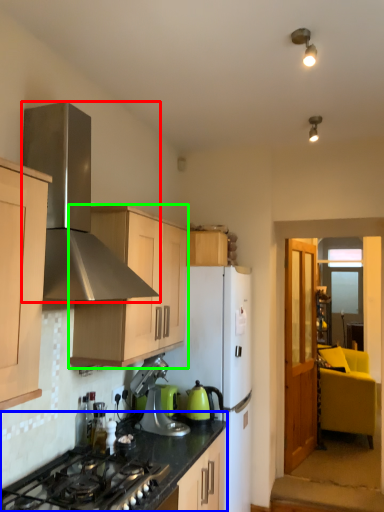
Question: Estimate the real-world distances between objects in this image. Which object is farther from home appliance (highlighted by a red box), countertop (highlighted by a blue box) or cabinetry (highlighted by a green box)?

Choices:
 (A) countertop
 (B) cabinetry

Answer: (A)